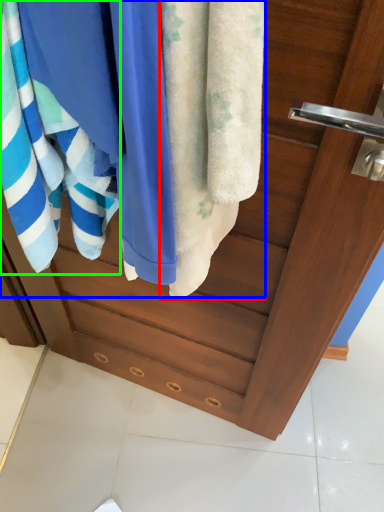
Question: Which object is positioned farthest from towel (highlighted by a red box)? Select from beach towel (highlighted by a blue box) and towel (highlighted by a green box).

Choices:
 (A) beach towel
 (B) towel

Answer: (B)